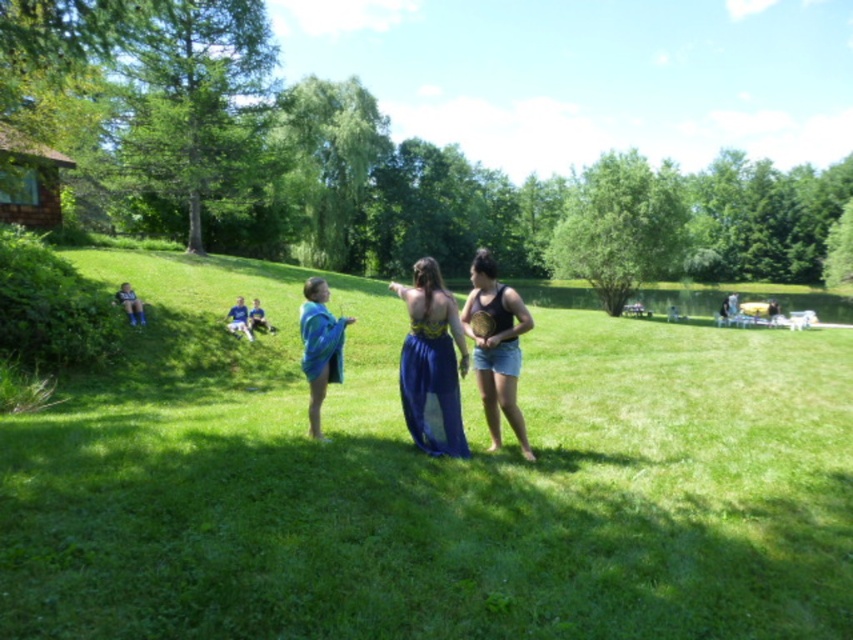
Can you confirm if shiny blue dress at center is positioned above blue denim shorts at lower left?

Actually, shiny blue dress at center is below blue denim shorts at lower left.

Looking at this image, can you confirm if shiny blue dress at center is shorter than blue denim shorts at lower left?

No, shiny blue dress at center is not shorter than blue denim shorts at lower left.

The image size is (853, 640). I want to click on shiny blue dress at center, so click(x=431, y=364).

Is blue satin dress at center shorter than blue denim shorts at lower left?

In fact, blue satin dress at center may be taller than blue denim shorts at lower left.

Can you confirm if blue satin dress at center is bigger than blue denim shorts at lower left?

Indeed, blue satin dress at center has a larger size compared to blue denim shorts at lower left.

Between point (257, 276) and point (117, 300), which one is positioned in front?

Point (117, 300) is more forward.

Where is `blue satin dress at center`? The width and height of the screenshot is (853, 640). blue satin dress at center is located at coordinates (430, 483).

In the scene shown: Is shiny blue dress at center to the right of black matte tank top at center from the viewer's perspective?

Incorrect, shiny blue dress at center is not on the right side of black matte tank top at center.

Looking at this image, does shiny blue dress at center have a greater width compared to black matte tank top at center?

No.

Is point (445, 356) more distant than point (485, 273)?

No.

This screenshot has height=640, width=853. Identify the location of shiny blue dress at center. (431, 364).